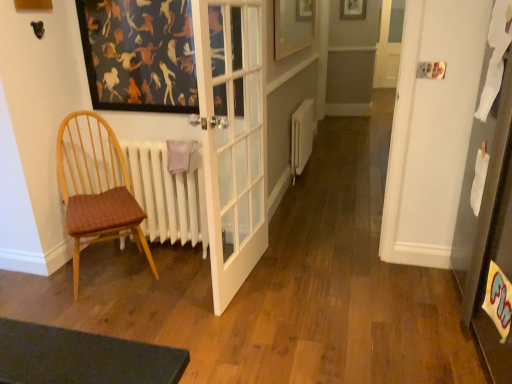
Identify the location of free space in front of white matte radiator at left. The image size is (512, 384). (172, 287).